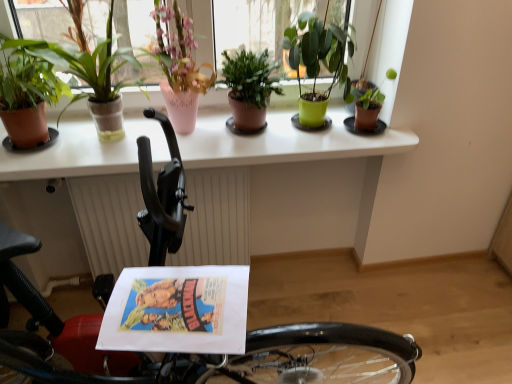
Locate an element on the screen. free point above white glossy counter top at upper center (from a real-world perspective) is located at coordinates (156, 128).